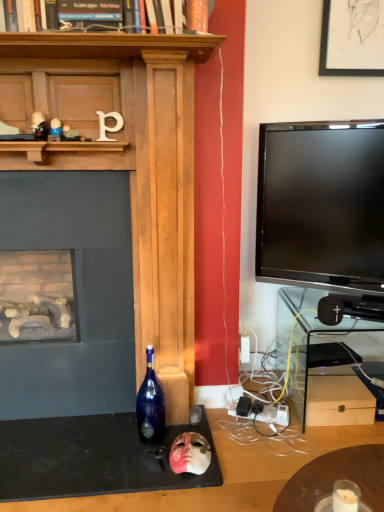
Question: Does white matte letter p at upper center appear on the right side of metallic silver toy at upper center, the 3th toy in the left-to-right sequence?

Choices:
 (A) yes
 (B) no

Answer: (A)

Question: From the image's perspective, is white matte letter p at upper center on top of metallic silver toy at upper center, the 3th toy in the left-to-right sequence?

Choices:
 (A) yes
 (B) no

Answer: (A)

Question: Could you tell me if white matte letter p at upper center is turned towards metallic silver toy at upper center, the second toy ordered from the bottom?

Choices:
 (A) yes
 (B) no

Answer: (B)

Question: Is white matte letter p at upper center directly adjacent to metallic silver toy at upper center, acting as the 2th toy starting from the right?

Choices:
 (A) no
 (B) yes

Answer: (A)

Question: Can you confirm if white matte letter p at upper center is wider than metallic silver toy at upper center, the second toy ordered from the bottom?

Choices:
 (A) no
 (B) yes

Answer: (A)

Question: Can you confirm if white matte letter p at upper center is positioned to the left of metallic silver toy at upper center, the 3th toy in the left-to-right sequence?

Choices:
 (A) no
 (B) yes

Answer: (A)

Question: Can black matte speaker at lower right be found inside metallic silver toy at upper center, acting as the 2th toy starting from the right?

Choices:
 (A) no
 (B) yes

Answer: (A)

Question: Does metallic silver toy at upper center, the second toy ordered from the bottom, have a greater width compared to black matte speaker at lower right?

Choices:
 (A) yes
 (B) no

Answer: (B)

Question: Would you consider metallic silver toy at upper center, the second toy ordered from the bottom, to be distant from black matte speaker at lower right?

Choices:
 (A) yes
 (B) no

Answer: (A)

Question: Does metallic silver toy at upper center, the second toy ordered from the bottom, have a larger size compared to black matte speaker at lower right?

Choices:
 (A) yes
 (B) no

Answer: (B)

Question: Is metallic silver toy at upper center, the 3th toy in the left-to-right sequence, with black matte speaker at lower right?

Choices:
 (A) no
 (B) yes

Answer: (A)

Question: Could you tell me if metallic silver toy at upper center, the second toy ordered from the bottom, is facing black matte speaker at lower right?

Choices:
 (A) yes
 (B) no

Answer: (B)

Question: Is metallic silver toy at upper center, which ranks as the third toy in top-to-bottom order, with metallic black figurine at upper left, which is the fourth toy in right-to-left order?

Choices:
 (A) yes
 (B) no

Answer: (A)